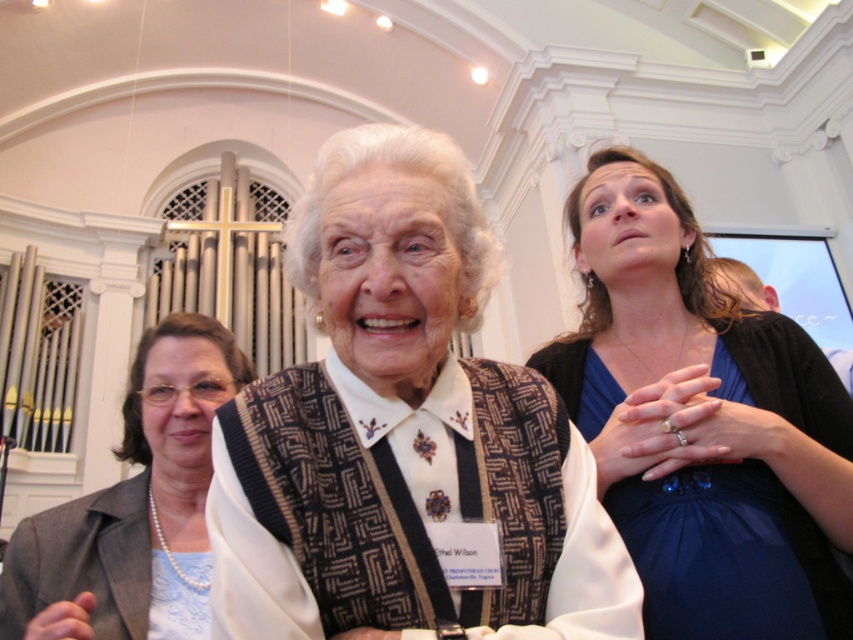
Who is positioned more to the right, blue satin dress at upper right or pearl necklace at left?

From the viewer's perspective, blue satin dress at upper right appears more on the right side.

Is point (848, 404) positioned before point (61, 625)?

No, it is not.

Locate an element on the screen. blue satin dress at upper right is located at coordinates (701, 422).

Does patterned fabric sweater at center lie in front of blue satin dress at upper right?

Yes, patterned fabric sweater at center is in front of blue satin dress at upper right.

Does patterned fabric sweater at center have a greater height compared to blue satin dress at upper right?

No.

Does point (444, 628) come in front of point (752, 547)?

That is True.

Find the location of a particular element. This screenshot has width=853, height=640. patterned fabric sweater at center is located at coordinates (405, 436).

Does patterned fabric sweater at center have a smaller size compared to pearl necklace at left?

No, patterned fabric sweater at center is not smaller than pearl necklace at left.

What do you see at coordinates (405, 436) in the screenshot?
I see `patterned fabric sweater at center` at bounding box center [405, 436].

What are the coordinates of `patterned fabric sweater at center` in the screenshot? It's located at (405, 436).